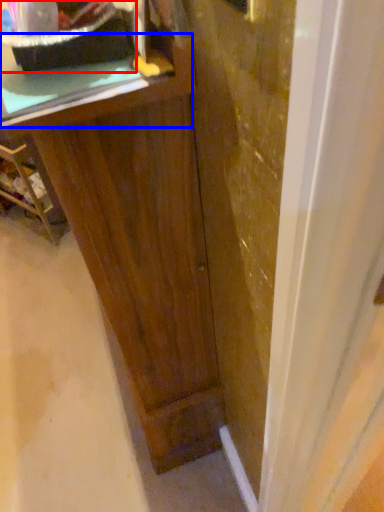
Question: Which object is closer to the camera taking this photo, appliance (highlighted by a red box) or counter top (highlighted by a blue box)?

Choices:
 (A) appliance
 (B) counter top

Answer: (A)